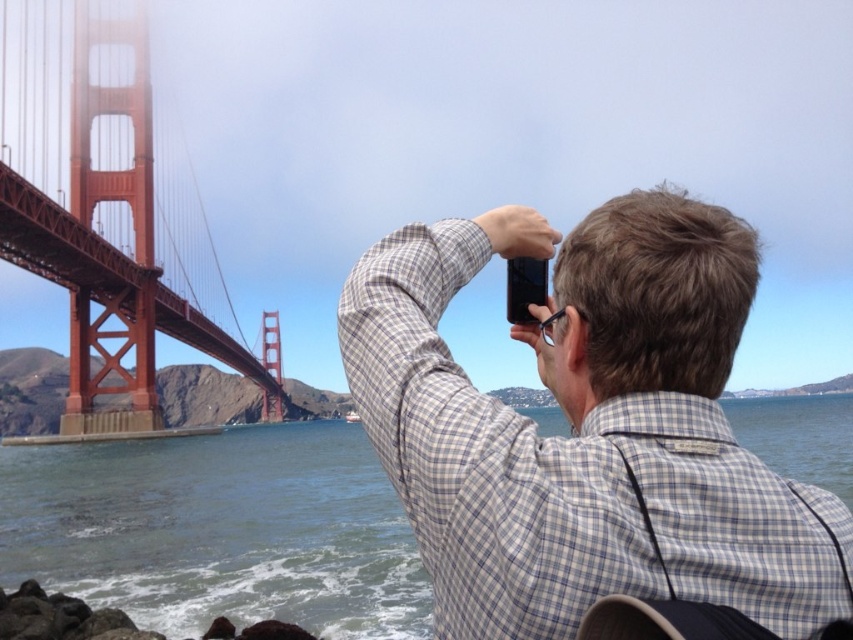
Consider the image. Between checkered shirt at upper right and clear blue water at lower left, which one has less height?

With less height is checkered shirt at upper right.

Which is in front, point (730, 456) or point (287, 600)?

Point (730, 456) is more forward.

Where is `checkered shirt at upper right`? The width and height of the screenshot is (853, 640). checkered shirt at upper right is located at coordinates (587, 428).

Is clear blue water at lower left taller than red painted steel suspension bridge at left?

Incorrect, clear blue water at lower left's height is not larger of red painted steel suspension bridge at left's.

Does clear blue water at lower left have a smaller size compared to red painted steel suspension bridge at left?

Correct, clear blue water at lower left occupies less space than red painted steel suspension bridge at left.

Is point (260, 449) positioned after point (125, 268)?

Yes.

I want to click on clear blue water at lower left, so click(219, 531).

Does checkered shirt at upper right appear over red painted steel suspension bridge at left?

No, checkered shirt at upper right is not above red painted steel suspension bridge at left.

You are a GUI agent. You are given a task and a screenshot of the screen. Output one action in this format:
    pyautogui.click(x=<x>, y=<y>)
    Task: Click on the checkered shirt at upper right
    
    Given the screenshot: What is the action you would take?
    (587, 428)

At what (x,y) coordinates should I click in order to perform the action: click on checkered shirt at upper right. Please return your answer as a coordinate pair (x, y). This screenshot has height=640, width=853. Looking at the image, I should click on (587, 428).